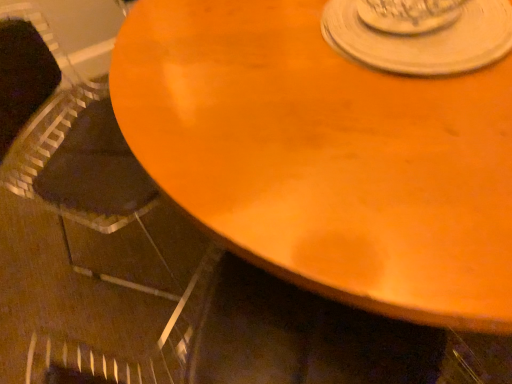
Question: Considering the positions of point (488, 57) and point (62, 112), is point (488, 57) closer or farther from the camera than point (62, 112)?

Choices:
 (A) farther
 (B) closer

Answer: (B)

Question: From a real-world perspective, is white matte saucer at upper center physically located above or below black fabric armchair at left?

Choices:
 (A) above
 (B) below

Answer: (A)

Question: Estimate the real-world distances between objects in this image. Which object is farther from the white matte saucer at upper center?

Choices:
 (A) black fabric armchair at left
 (B) wooden table at center

Answer: (A)

Question: Which of these objects is positioned closest to the white matte saucer at upper center?

Choices:
 (A) wooden table at center
 (B) black fabric armchair at left

Answer: (A)